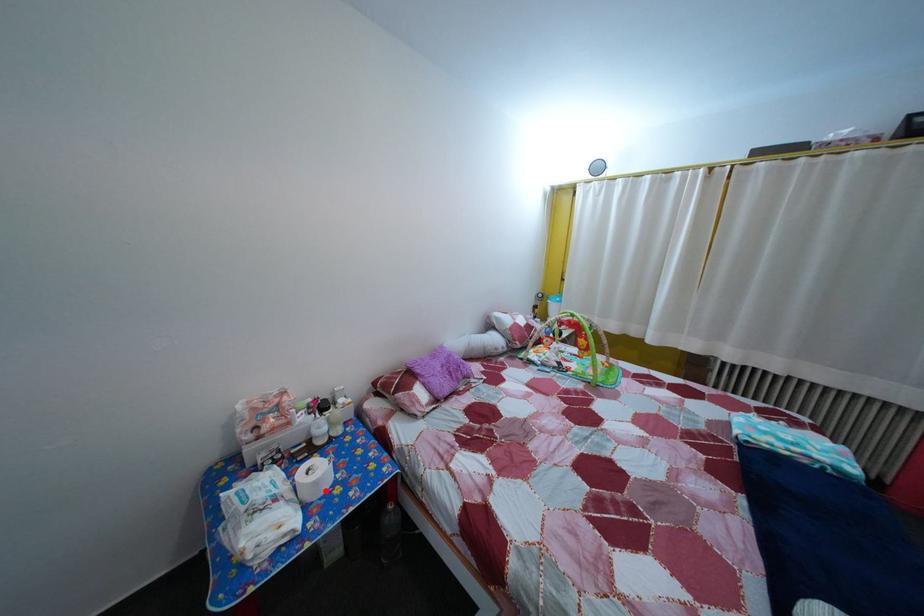
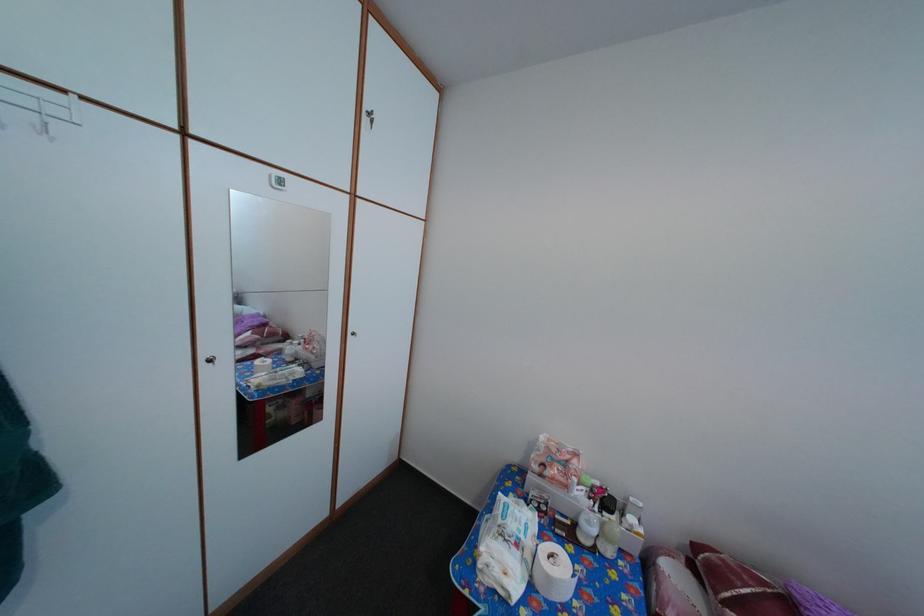
The point at the highlighted location is marked in the first image. Where is the corresponding point in the second image?

(558, 586)